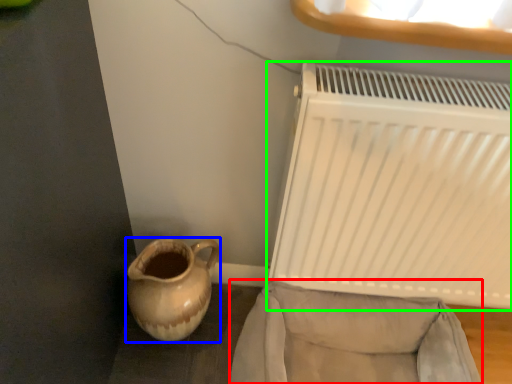
Question: Estimate the real-world distances between objects in this image. Which object is closer to armchair (highlighted by a red box), jug (highlighted by a blue box) or radiator (highlighted by a green box)?

Choices:
 (A) jug
 (B) radiator

Answer: (B)